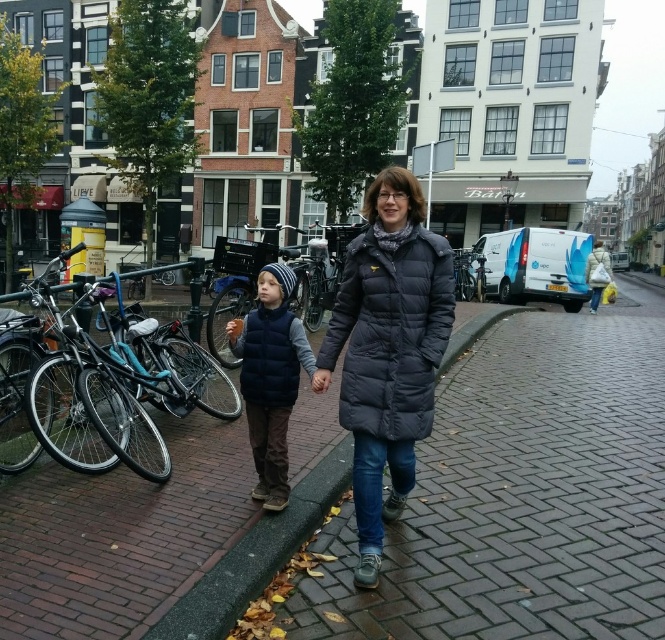
Can you confirm if shiny blue bicycle at left is positioned to the left of velvet navy vest at center?

Yes, shiny blue bicycle at left is to the left of velvet navy vest at center.

Who is more distant from viewer, (x=164, y=445) or (x=259, y=458)?

The point (x=164, y=445) is behind.

Identify the location of shiny blue bicycle at left. (114, 381).

This screenshot has width=665, height=640. I want to click on shiny blue bicycle at left, so click(x=114, y=381).

Can you confirm if brick at center is bigger than velvet navy vest at center?

Actually, brick at center might be smaller than velvet navy vest at center.

Is point (346, 440) in front of point (271, 284)?

No, it is behind (271, 284).

Locate an element on the screen. The width and height of the screenshot is (665, 640). brick at center is located at coordinates (255, 554).

Can you confirm if navy puffer coat at center is positioned to the left of velvet navy vest at center?

No, navy puffer coat at center is not to the left of velvet navy vest at center.

Describe the element at coordinates (390, 332) in the screenshot. I see `navy puffer coat at center` at that location.

Identify the location of navy puffer coat at center. This screenshot has width=665, height=640. (390, 332).